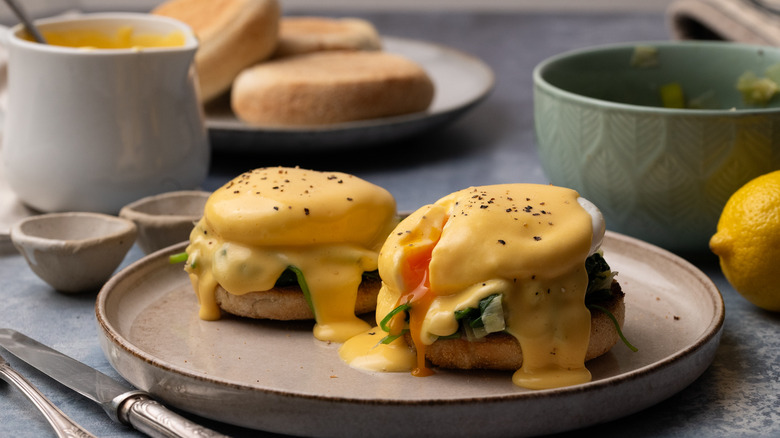
The width and height of the screenshot is (780, 438). In order to click on table top in this screenshot , I will do `click(742, 418)`, `click(449, 168)`, `click(533, 40)`.